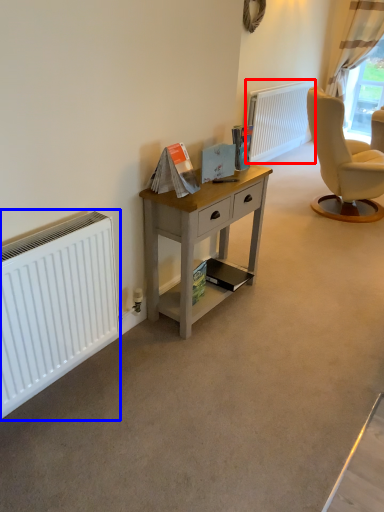
Question: Which object appears farthest to the camera in this image, radiator (highlighted by a red box) or radiator (highlighted by a blue box)?

Choices:
 (A) radiator
 (B) radiator

Answer: (A)